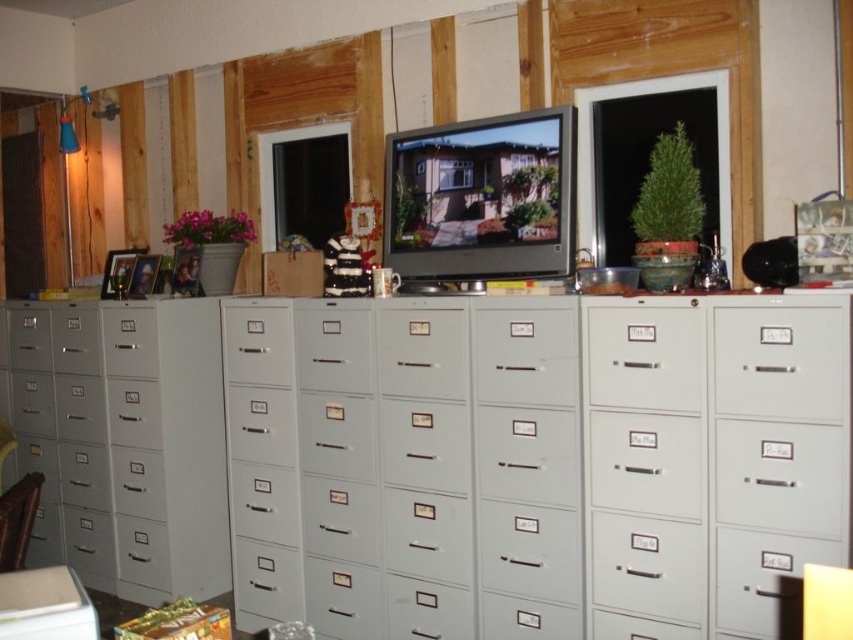
From the picture: Is gray metal file cabinet at center shorter than matte gray filing cabinet at center?

In fact, gray metal file cabinet at center may be taller than matte gray filing cabinet at center.

Locate an element on the screen. gray metal file cabinet at center is located at coordinates (556, 467).

In the scene shown: Does gray metal file cabinet at center have a lesser width compared to metallic gray filing cabinet at left?

No, gray metal file cabinet at center is not thinner than metallic gray filing cabinet at left.

Looking at this image, how much distance is there between gray metal file cabinet at center and metallic gray filing cabinet at left?

1.12 meters

Who is more distant from viewer, (540, 348) or (56, 339)?

Point (56, 339)

Locate an element on the screen. gray metal file cabinet at center is located at coordinates (556, 467).

Does metallic gray filing cabinet at center-right come behind matte gray file cabinet at left?

No.

Can you confirm if metallic gray filing cabinet at center-right is bigger than matte gray file cabinet at left?

No.

Where is `metallic gray filing cabinet at center-right`? The image size is (853, 640). metallic gray filing cabinet at center-right is located at coordinates (781, 362).